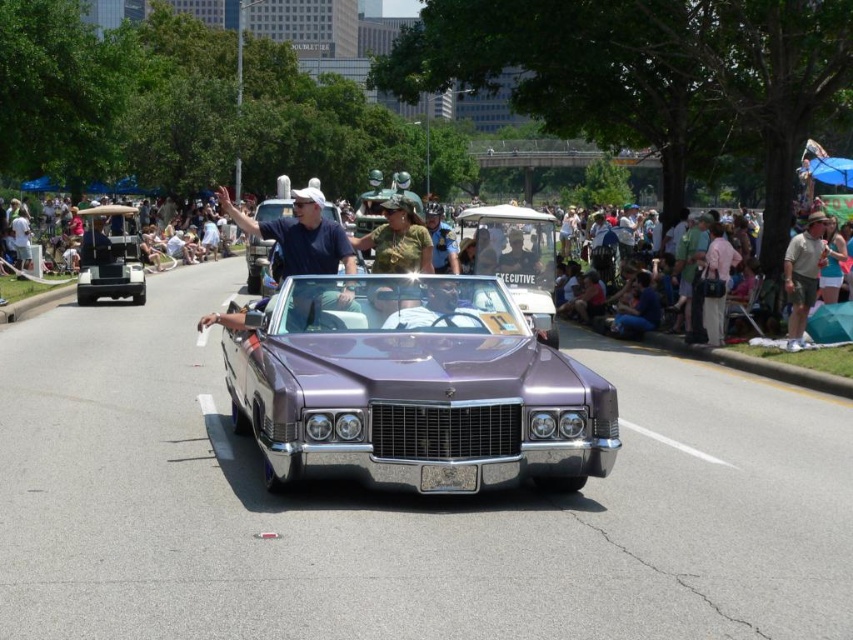
Between khaki cotton shirt at right and purple metallic car at center, which one is positioned higher?

Positioned higher is purple metallic car at center.

Who is more forward, (824, 250) or (263, 272)?

Point (824, 250)

Where is `khaki cotton shirt at right`? khaki cotton shirt at right is located at coordinates (804, 275).

Does metallic blue shirt at center lie behind purple metallic car at center?

No, it is not.

Who is more forward, (303, 193) or (248, 241)?

Point (303, 193)

Find the location of a particular element. metallic blue shirt at center is located at coordinates (300, 234).

Is metallic purple car at center shorter than khaki cotton shirt at right?

Yes, metallic purple car at center is shorter than khaki cotton shirt at right.

Does metallic purple car at center appear on the right side of khaki cotton shirt at right?

In fact, metallic purple car at center is to the left of khaki cotton shirt at right.

Is point (329, 412) farther from camera compared to point (799, 304)?

No, it is in front of (799, 304).

Identify the location of metallic purple car at center. (413, 387).